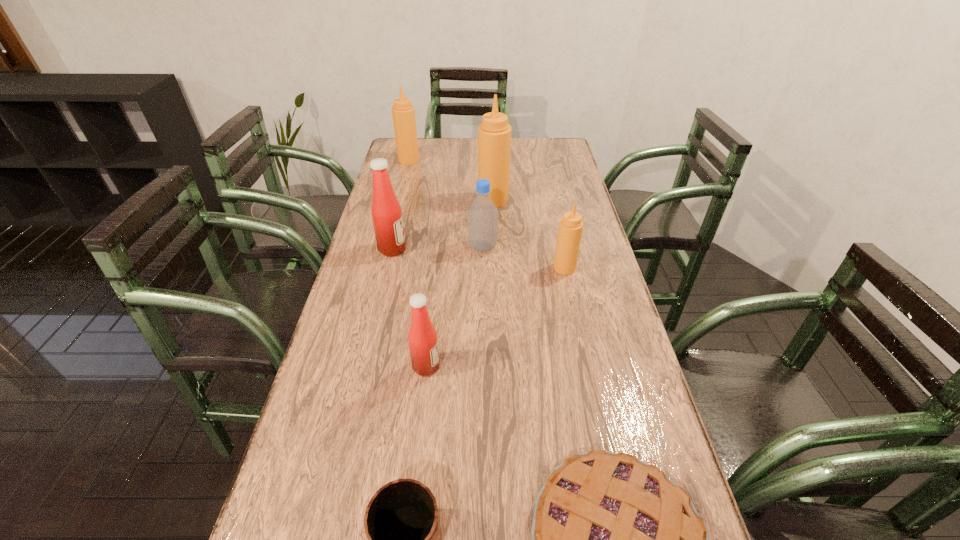
At what (x,y) coordinates should I click in order to perform the action: click on the third condiment from left to right. Please return your answer as a coordinate pair (x, y). The height and width of the screenshot is (540, 960). Looking at the image, I should click on (423, 343).

The height and width of the screenshot is (540, 960). I want to click on blank space located 0.330m on the back of the second tan condiment from right to left, so click(492, 151).

This screenshot has width=960, height=540. Find the location of `free spot located 0.150m on the right of the farthest tan condiment`. free spot located 0.150m on the right of the farthest tan condiment is located at coordinates (456, 160).

Where is `vacant area located 0.370m on the front-facing side of the bigger red condiment`? The height and width of the screenshot is (540, 960). vacant area located 0.370m on the front-facing side of the bigger red condiment is located at coordinates (525, 249).

Locate an element on the screen. The width and height of the screenshot is (960, 540). free location located 0.170m on the back of the bottle is located at coordinates (483, 208).

Locate an element on the screen. This screenshot has height=540, width=960. free point located on the front of the rightmost condiment is located at coordinates (569, 289).

I want to click on free space located 0.230m on the front-facing side of the smaller red condiment, so click(x=537, y=366).

Where is `object present at the far edge`? The height and width of the screenshot is (540, 960). object present at the far edge is located at coordinates (403, 112).

You are a GUI agent. You are given a task and a screenshot of the screen. Output one action in this format:
    pyautogui.click(x=<x>, y=<y>)
    Task: Click on the object present at the right edge
    The height and width of the screenshot is (540, 960).
    Given the screenshot: What is the action you would take?
    (570, 230)

Where is `object that is at the far left corner`? Image resolution: width=960 pixels, height=540 pixels. object that is at the far left corner is located at coordinates (403, 112).